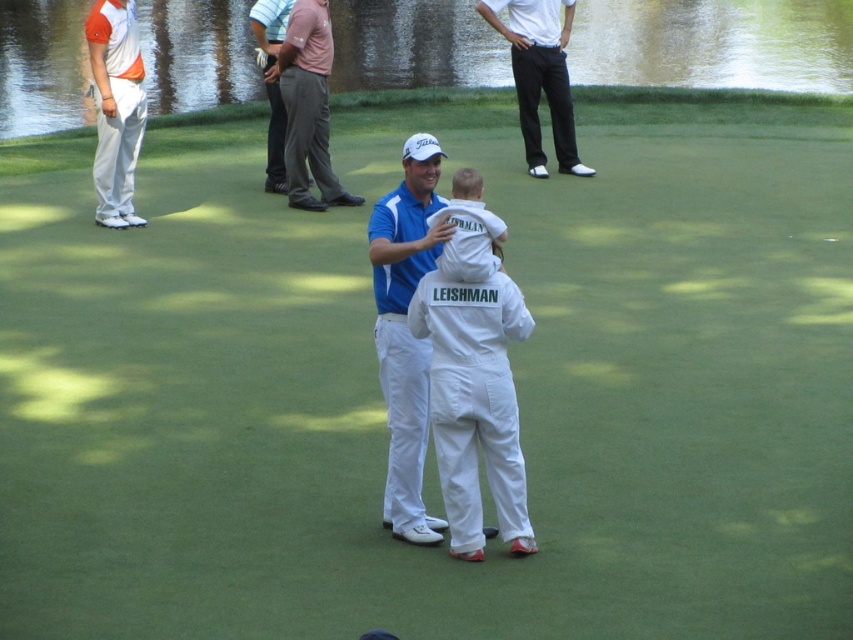
You are standing at the center of the golf course and see the point marked at coordinates (538, 76). What object is located at that point?

The point at coordinates (538, 76) indicates dark gray pants at upper center.

You are a fashion designer observing the golf course scene. You need to determine which item of clothing is narrower between the blue smooth shirt at center and the pink fabric pants at upper center. Which one is narrower?

The blue smooth shirt at center is narrower than the pink fabric pants at upper center because its width is less than the latter.

You are standing at the point labeled point (424,396) and want to walk towards the point labeled point (131,182). Given that both points are on the golf course, which direction should you head?

You should head away from the viewer since point (131,182) is further away than point (424,396).